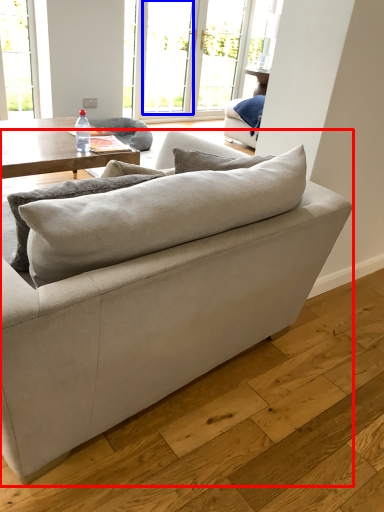
Question: Which of the following is the closest to the observer, studio couch (highlighted by a red box) or window (highlighted by a blue box)?

Choices:
 (A) studio couch
 (B) window

Answer: (A)